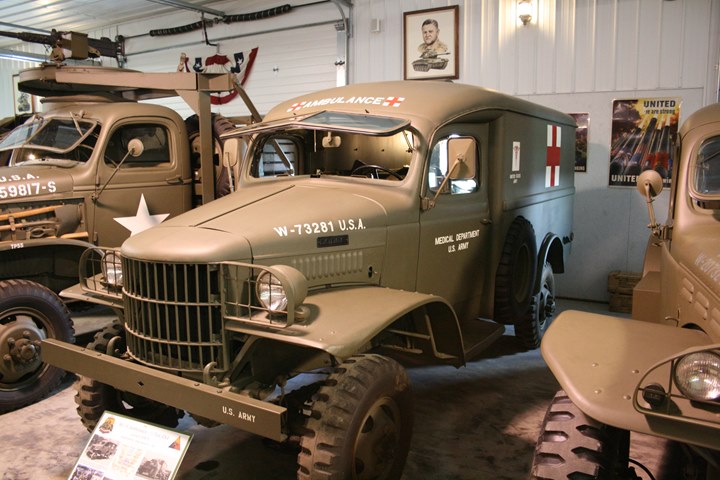
Where is `light gray and light brown splotchy floor`? Image resolution: width=720 pixels, height=480 pixels. light gray and light brown splotchy floor is located at coordinates (459, 441).